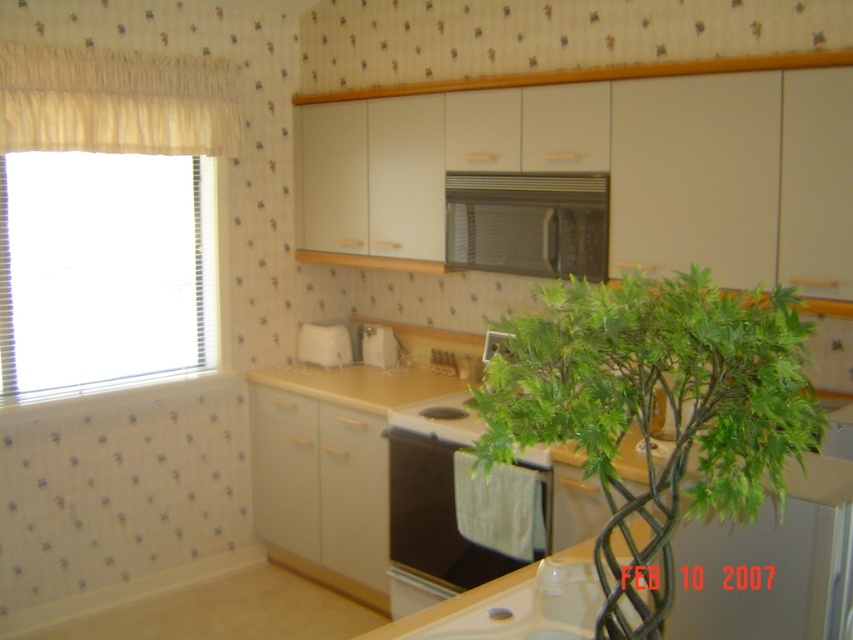
Is black matte oven at center closer to camera compared to white glossy sink at lower center?

No.

Based on the photo, does black matte oven at center appear on the left side of white glossy sink at lower center?

Yes, black matte oven at center is to the left of white glossy sink at lower center.

The height and width of the screenshot is (640, 853). What do you see at coordinates (439, 524) in the screenshot?
I see `black matte oven at center` at bounding box center [439, 524].

I want to click on black matte oven at center, so click(439, 524).

Is point (91, 266) behind point (494, 340)?

No.

Where is `transparent glass window at left`? The width and height of the screenshot is (853, 640). transparent glass window at left is located at coordinates (105, 269).

Describe the element at coordinates (105, 269) in the screenshot. The image size is (853, 640). I see `transparent glass window at left` at that location.

Where is `transparent glass window at left`? This screenshot has height=640, width=853. transparent glass window at left is located at coordinates (105, 269).

Which is more to the left, white matte toaster at center or satin silver toaster at center?

Positioned to the left is white matte toaster at center.

Between white matte toaster at center and satin silver toaster at center, which one has more height?

white matte toaster at center

Who is more distant from viewer, (386,355) or (494,342)?

The point (386,355) is more distant.

At what (x,y) coordinates should I click in order to perform the action: click on white matte toaster at center. Please return your answer as a coordinate pair (x, y). Looking at the image, I should click on (378, 346).